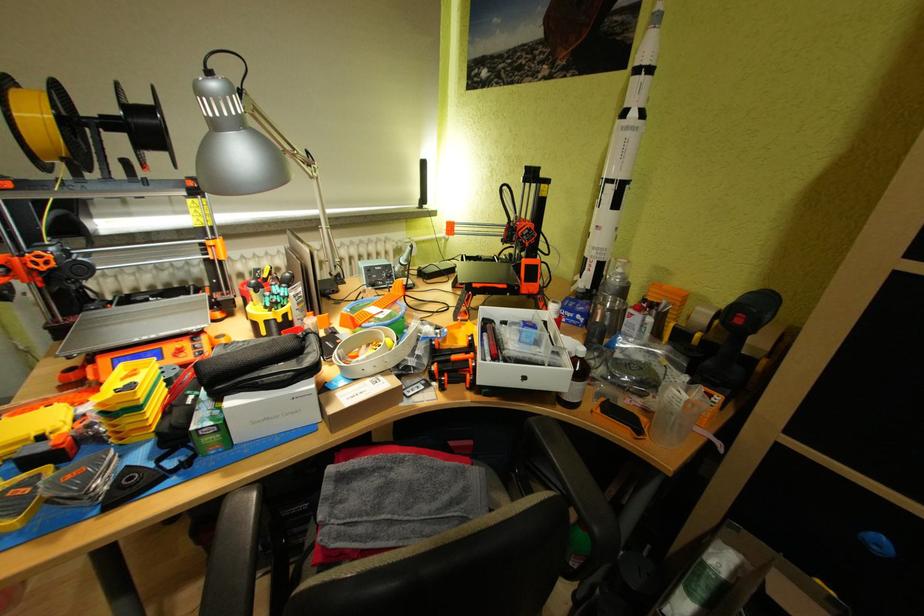
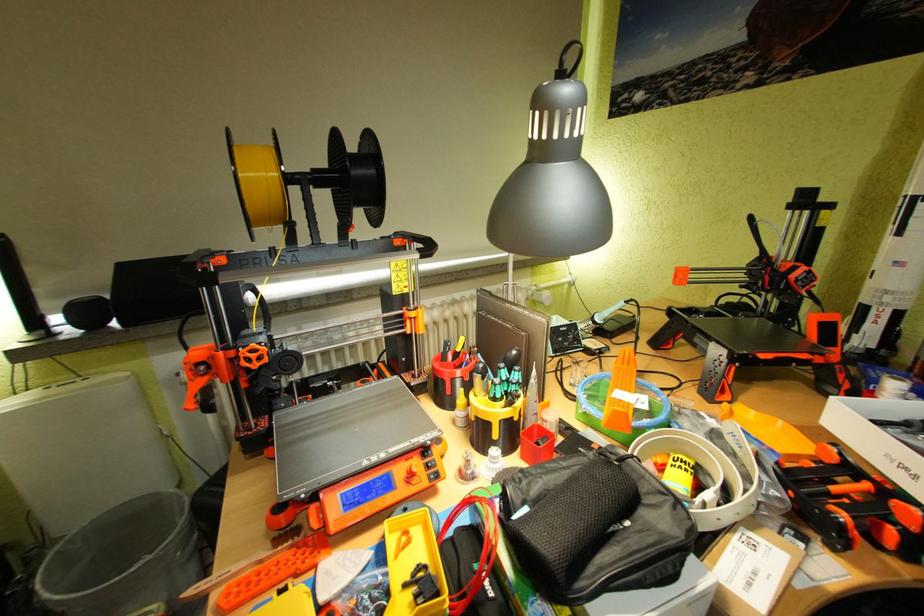
Which direction would the cameraman need to move to produce the second image?

The cameraman moved toward left, forward.